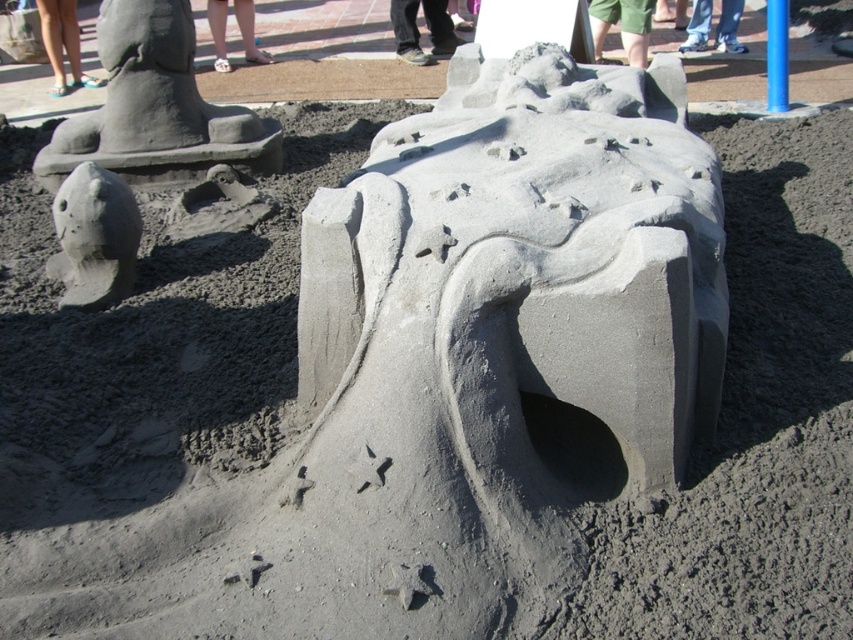
From the picture: You are standing in front of the sand sculpture and want to place a green shorts at upper center. According to the coordinates provided, where exactly should you place it?

The green shorts at upper center should be placed at point coordinates of (622, 26).

You are standing in front of the sand sculptures and want to take a photo of the gray sand sculpture at left and the green shorts at upper center. Which one will appear larger in the photo?

The gray sand sculpture at left will appear larger in the photo because it is closer to the viewer than the green shorts at upper center.